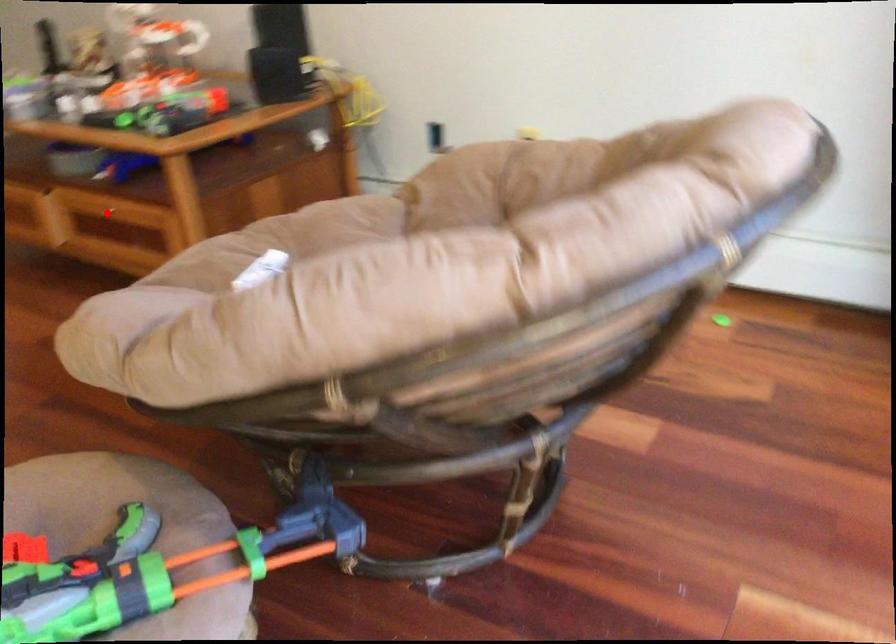
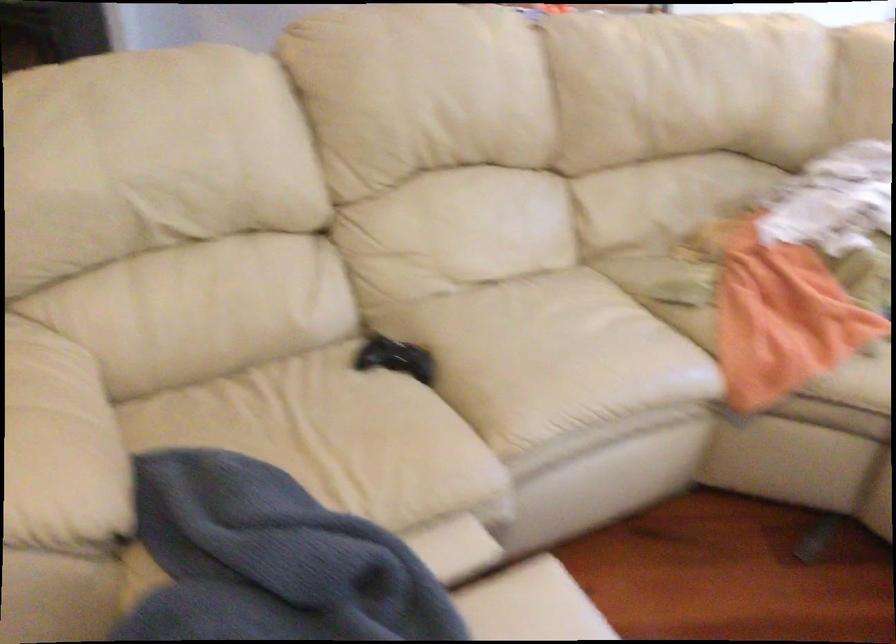
Question: I am providing you with two images of the same scene from different viewpoints. A red point is marked on the first image. At the location where the point appears in image 1, is it still visible in image 2?

Choices:
 (A) Yes
 (B) No

Answer: (B)